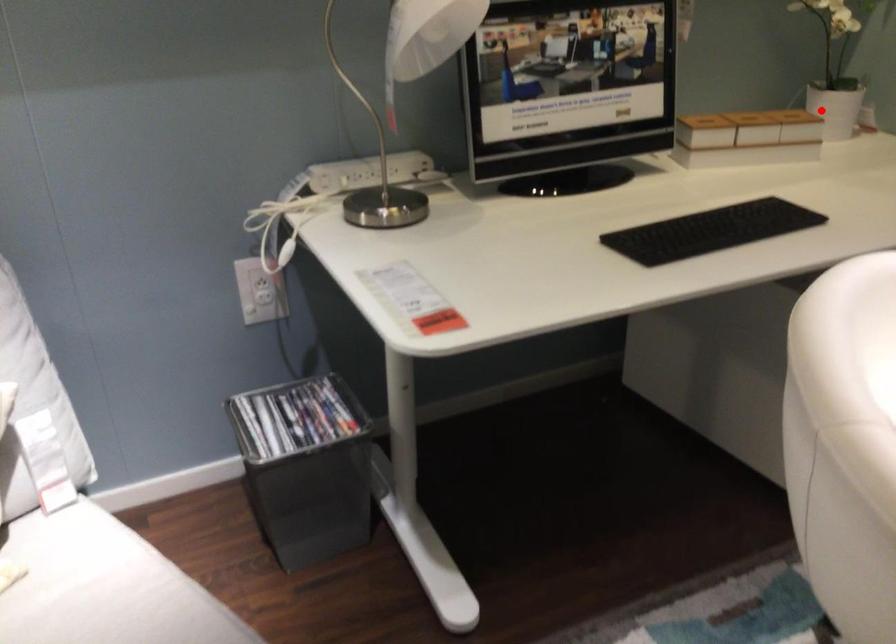
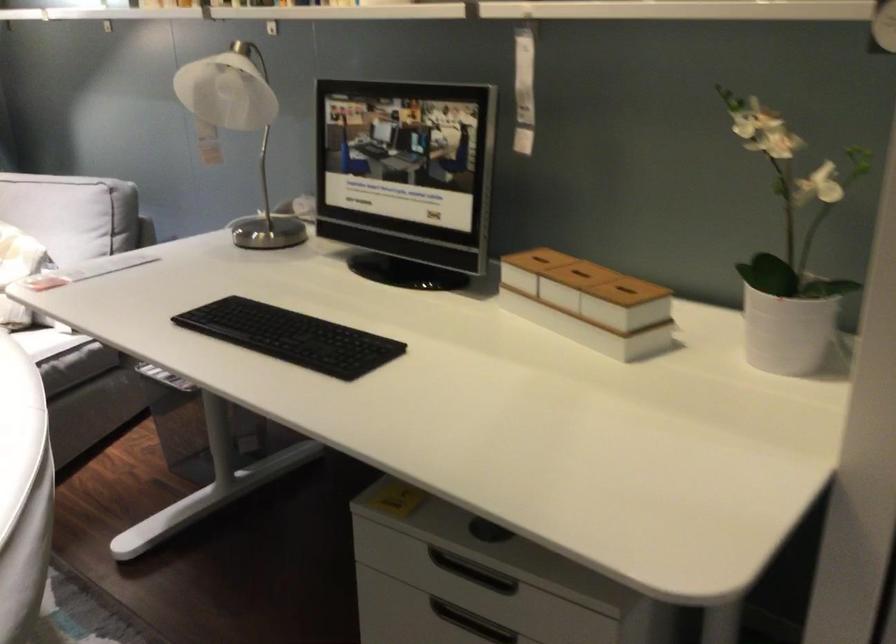
Question: I am providing you with two images of the same scene from different viewpoints. Given a red point in image1, look at the same physical point in image2. Is it:

Choices:
 (A) Closer to the viewpoint
 (B) Farther from the viewpoint

Answer: (A)